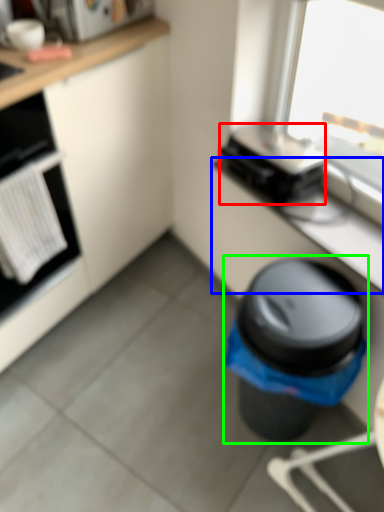
Question: Estimate the real-world distances between objects in this image. Which object is farther from appliance (highlighted by a red box), counter top (highlighted by a blue box) or waste container (highlighted by a green box)?

Choices:
 (A) counter top
 (B) waste container

Answer: (B)